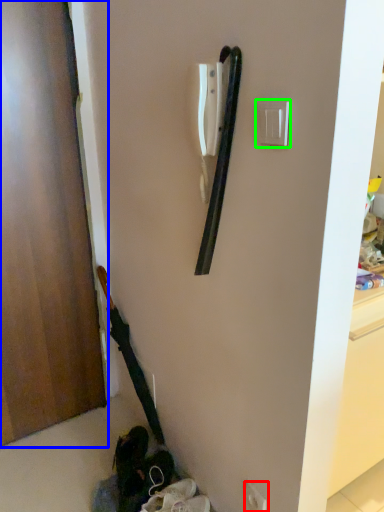
Question: Estimate the real-world distances between objects in this image. Which object is farther from electric outlet (highlighted by a red box), door (highlighted by a blue box) or light switch (highlighted by a green box)?

Choices:
 (A) door
 (B) light switch

Answer: (A)